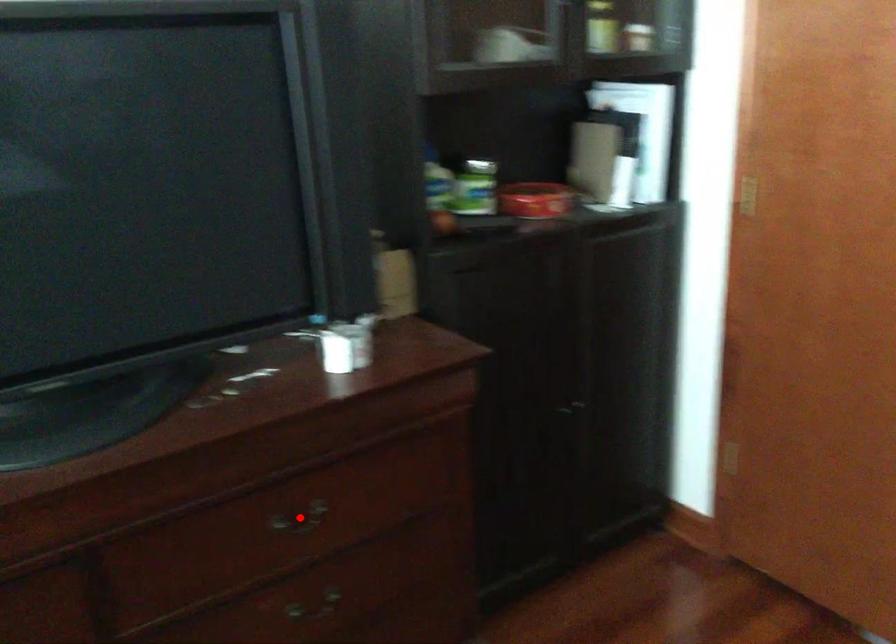
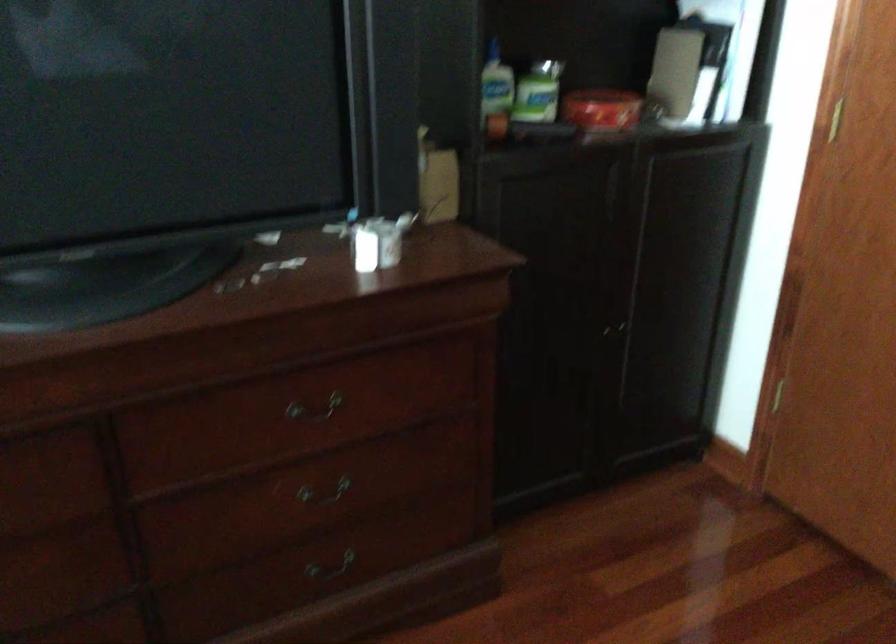
In the second image, find the point that corresponds to the highlighted location in the first image.

(314, 409)